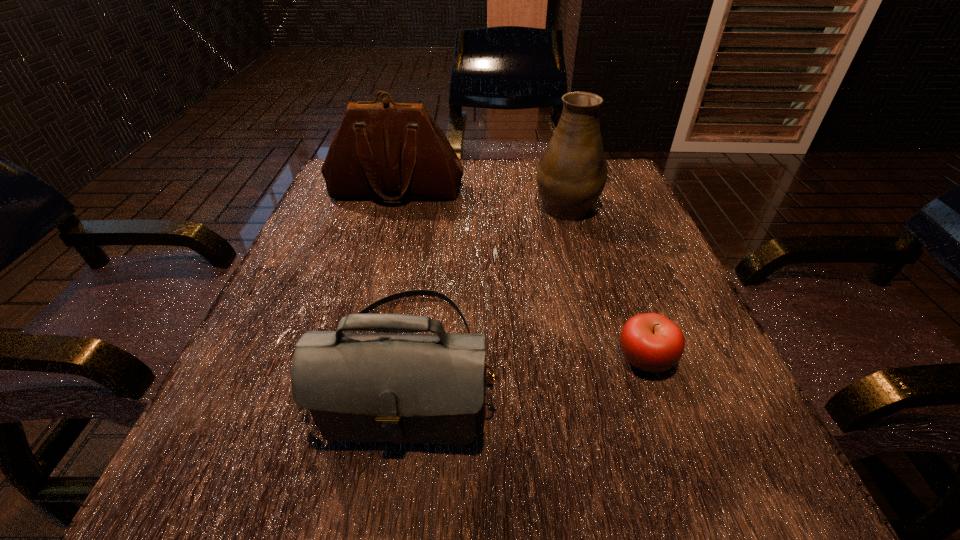
You are a GUI agent. You are given a task and a screenshot of the screen. Output one action in this format:
    pyautogui.click(x=<x>, y=<y>)
    Task: Click on the free space at the near edge of the desktop
    
    Given the screenshot: What is the action you would take?
    pyautogui.click(x=477, y=472)

Locate an element on the screen. The image size is (960, 540). vacant space at the left edge of the desktop is located at coordinates (290, 346).

Where is `vacant area at the right edge of the desktop`? The width and height of the screenshot is (960, 540). vacant area at the right edge of the desktop is located at coordinates [626, 300].

In the image, there is a desktop. What are the coordinates of `vacant space at the near left corner` in the screenshot? It's located at (312, 471).

In the image, there is a desktop. Where is `vacant space at the near right corner`? The width and height of the screenshot is (960, 540). vacant space at the near right corner is located at coordinates (715, 489).

Locate an element on the screen. The image size is (960, 540). vacant area that lies between the third tallest object and the farther shoulder bag is located at coordinates (401, 278).

This screenshot has width=960, height=540. Find the location of `empty location between the second shortest object and the farther shoulder bag`. empty location between the second shortest object and the farther shoulder bag is located at coordinates (401, 278).

Where is `vacant point located between the pitcher and the shortest object`? Image resolution: width=960 pixels, height=540 pixels. vacant point located between the pitcher and the shortest object is located at coordinates (606, 282).

Locate an element on the screen. This screenshot has height=540, width=960. vacant space that is in between the shortest object and the second shortest object is located at coordinates (526, 362).

The height and width of the screenshot is (540, 960). What are the coordinates of `free point between the second shortest object and the shortest object` in the screenshot? It's located at (526, 362).